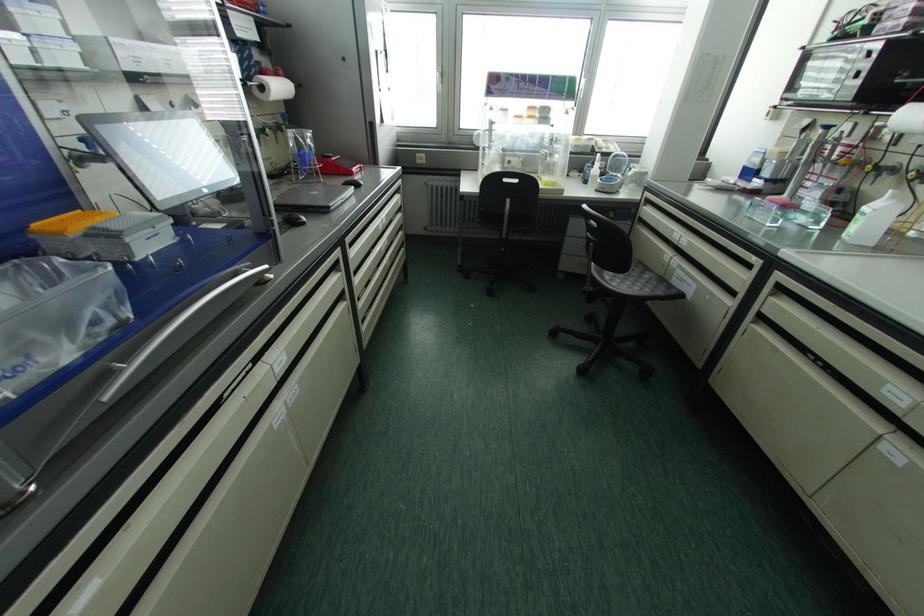
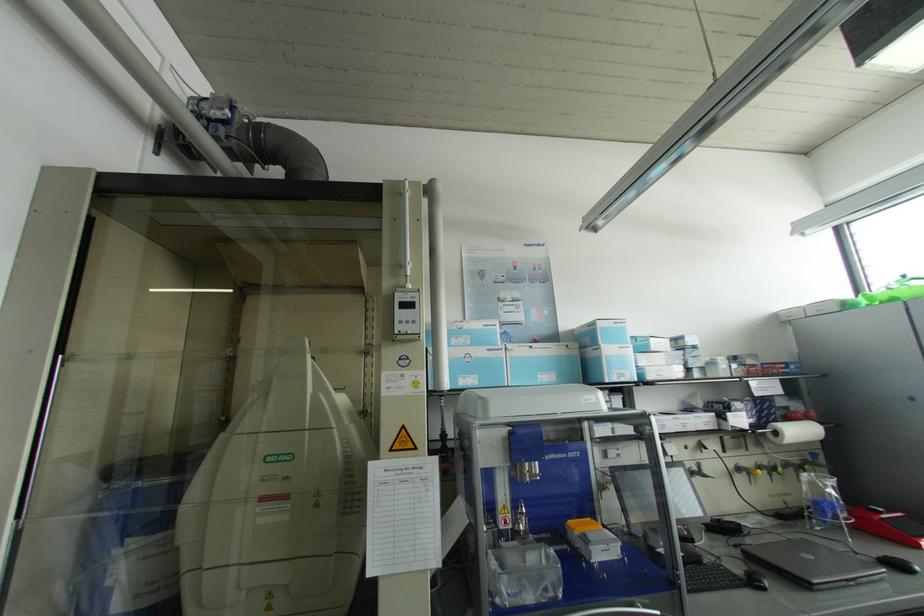
How did the camera likely rotate?

The camera's rotation is toward left-up.